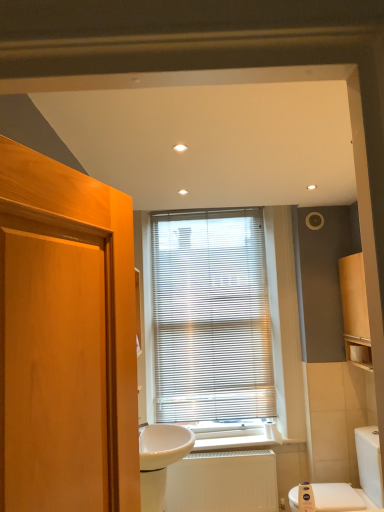
Question: From the image's perspective, would you say white matte toilet paper at right is shown under white glossy toilet at lower right?

Choices:
 (A) yes
 (B) no

Answer: (B)

Question: From a real-world perspective, is white matte toilet paper at right located beneath white glossy toilet at lower right?

Choices:
 (A) no
 (B) yes

Answer: (A)

Question: Does white matte toilet paper at right have a lesser width compared to white glossy toilet at lower right?

Choices:
 (A) no
 (B) yes

Answer: (B)

Question: Can you confirm if white matte toilet paper at right is bigger than white glossy toilet at lower right?

Choices:
 (A) yes
 (B) no

Answer: (B)

Question: Is white matte toilet paper at right at the left side of white glossy toilet at lower right?

Choices:
 (A) no
 (B) yes

Answer: (A)

Question: Considering the positions of matte wood cabinet at right and white matte toilet paper at right in the image, is matte wood cabinet at right taller or shorter than white matte toilet paper at right?

Choices:
 (A) tall
 (B) short

Answer: (A)

Question: Is matte wood cabinet at right spatially inside white matte toilet paper at right, or outside of it?

Choices:
 (A) outside
 (B) inside

Answer: (A)

Question: Is matte wood cabinet at right bigger or smaller than white matte toilet paper at right?

Choices:
 (A) small
 (B) big

Answer: (B)

Question: From the image's perspective, is matte wood cabinet at right located above or below white matte toilet paper at right?

Choices:
 (A) below
 (B) above

Answer: (B)

Question: Based on their sizes in the image, would you say metallic blinds at center is bigger or smaller than white matte toilet paper at right?

Choices:
 (A) big
 (B) small

Answer: (A)

Question: From the image's perspective, is metallic blinds at center positioned above or below white matte toilet paper at right?

Choices:
 (A) below
 (B) above

Answer: (B)

Question: From a real-world perspective, is metallic blinds at center above or below white matte toilet paper at right?

Choices:
 (A) below
 (B) above

Answer: (B)

Question: Based on their positions, is metallic blinds at center located to the left or right of white matte toilet paper at right?

Choices:
 (A) right
 (B) left

Answer: (B)

Question: Looking at their shapes, would you say white glossy sink at center is wider or thinner than metallic blinds at center?

Choices:
 (A) thin
 (B) wide

Answer: (B)

Question: Would you say white glossy sink at center is to the left or to the right of metallic blinds at center in the picture?

Choices:
 (A) right
 (B) left

Answer: (B)